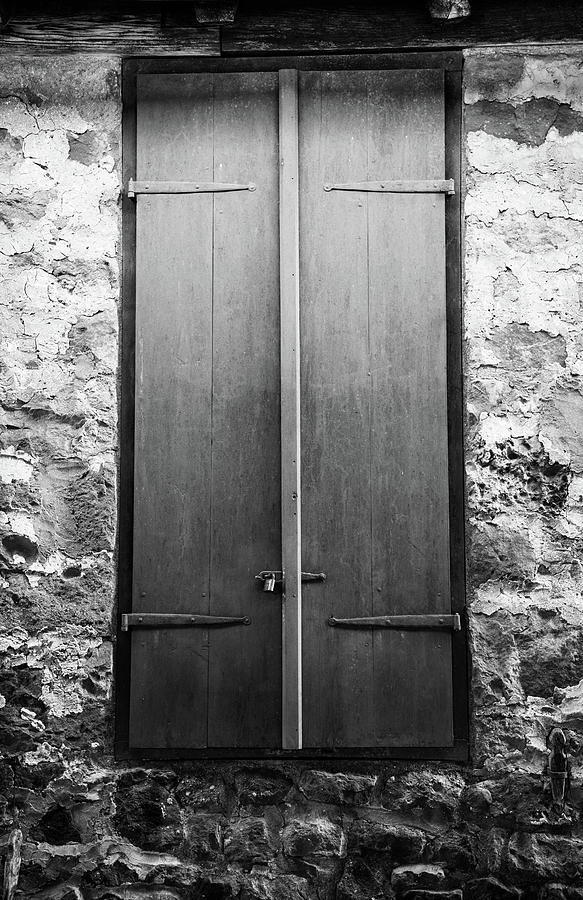
Locate an element on the screen. This screenshot has width=583, height=900. metal piece for locking door is located at coordinates (310, 577), (259, 574).